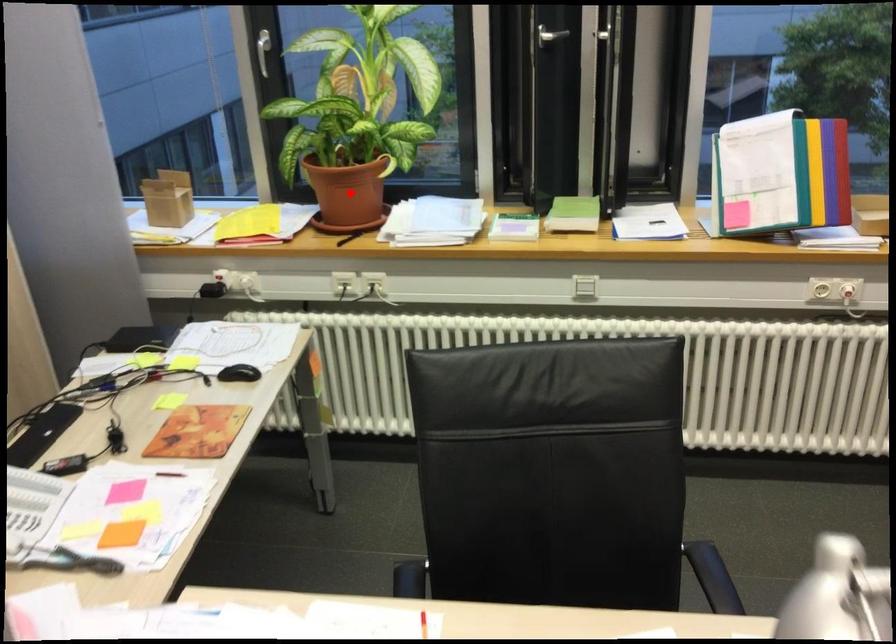
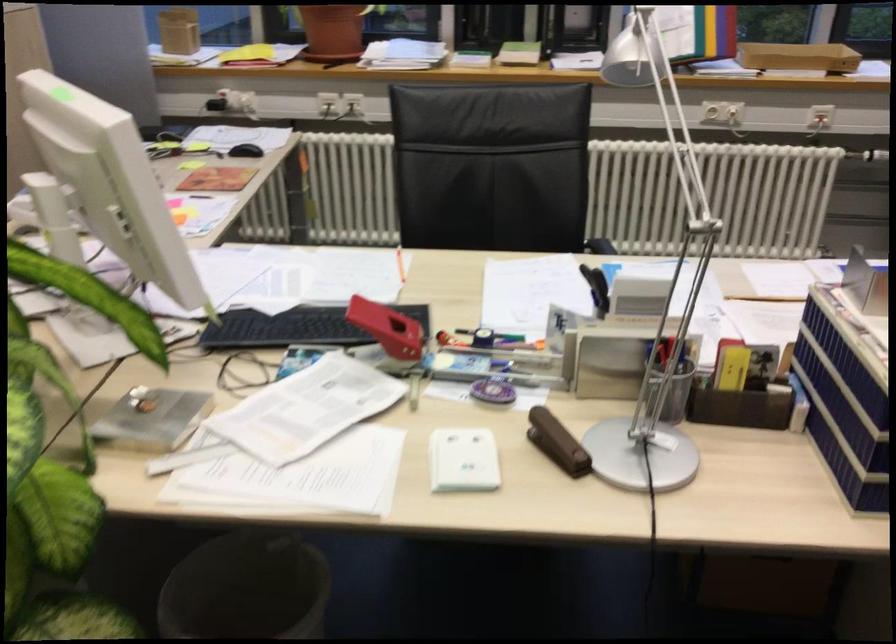
Locate, in the second image, the point that corresponds to the highlighted location in the first image.

(332, 31)